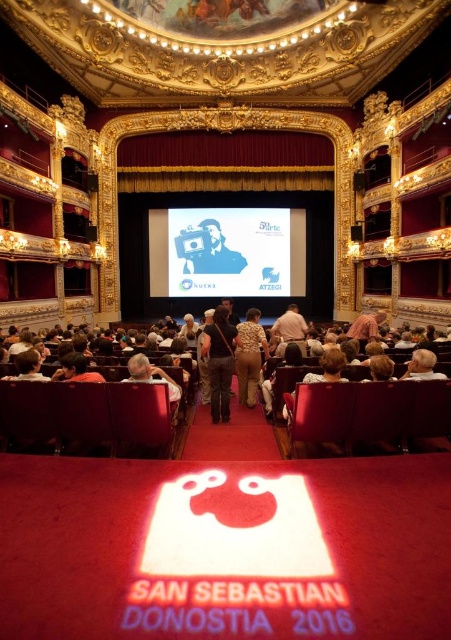
Who is positioned more to the left, dark gray fabric jacket at center or blue glossy camera at center?

Positioned to the left is blue glossy camera at center.

Between dark gray fabric jacket at center and blue glossy camera at center, which one is positioned higher?

blue glossy camera at center

Where is `dark gray fabric jacket at center`? The height and width of the screenshot is (640, 451). dark gray fabric jacket at center is located at coordinates (220, 362).

Who is more distant from viewer, (x=266, y=234) or (x=178, y=240)?

The point (x=266, y=234) is more distant.

Is white paper at center positioned before blue glossy camera at center?

Yes, it is in front of blue glossy camera at center.

This screenshot has height=640, width=451. What do you see at coordinates (226, 252) in the screenshot? I see `white paper at center` at bounding box center [226, 252].

Locate an element on the screen. Image resolution: width=451 pixels, height=640 pixels. white paper at center is located at coordinates (226, 252).

Is dark gray fabric jacket at center thinner than gold sequined dress at center?

Correct, dark gray fabric jacket at center's width is less than gold sequined dress at center's.

Which is behind, point (216, 364) or point (239, 332)?

Point (239, 332)

Identify the location of dark gray fabric jacket at center. Image resolution: width=451 pixels, height=640 pixels. (220, 362).